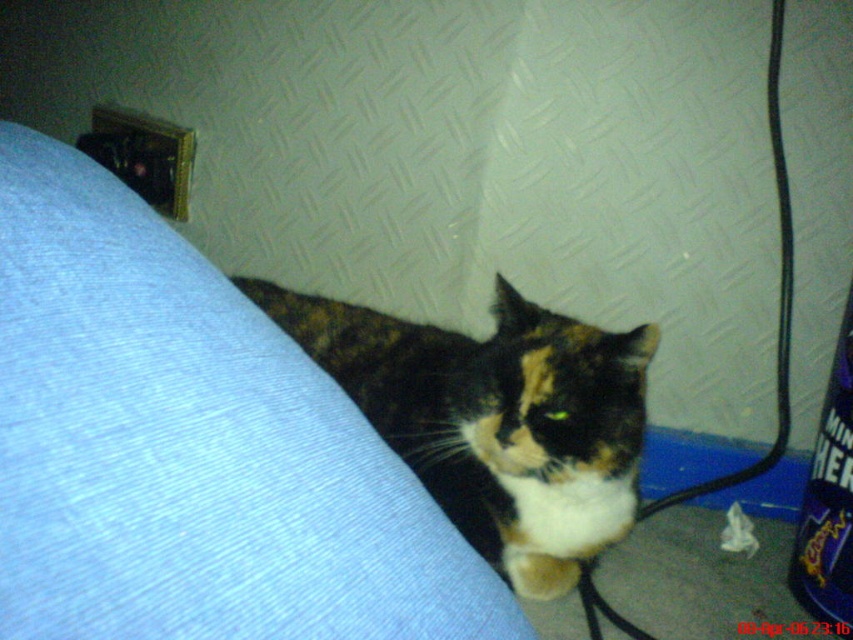
Question: Which of the following is the farthest from the observer?

Choices:
 (A) calico fur cat at center
 (B) blue fabric couch at lower left

Answer: (A)

Question: Where is blue fabric couch at lower left located in relation to calico fur cat at center in the image?

Choices:
 (A) right
 (B) left

Answer: (B)

Question: Which of the following is the closest to the observer?

Choices:
 (A) blue fabric couch at lower left
 (B) calico fur cat at center

Answer: (A)

Question: Is blue fabric couch at lower left below calico fur cat at center?

Choices:
 (A) no
 (B) yes

Answer: (A)

Question: Observing the image, what is the correct spatial positioning of blue fabric couch at lower left in reference to calico fur cat at center?

Choices:
 (A) below
 (B) above

Answer: (B)

Question: Which of the following is the closest to the observer?

Choices:
 (A) blue fabric couch at lower left
 (B) calico fur cat at center

Answer: (A)